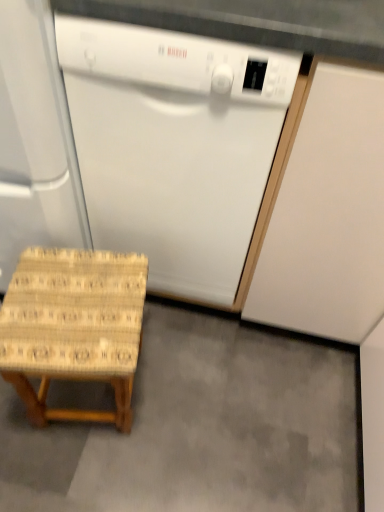
This screenshot has width=384, height=512. Identify the location of vacant area that is in front of woven wood stool at lower left. (83, 470).